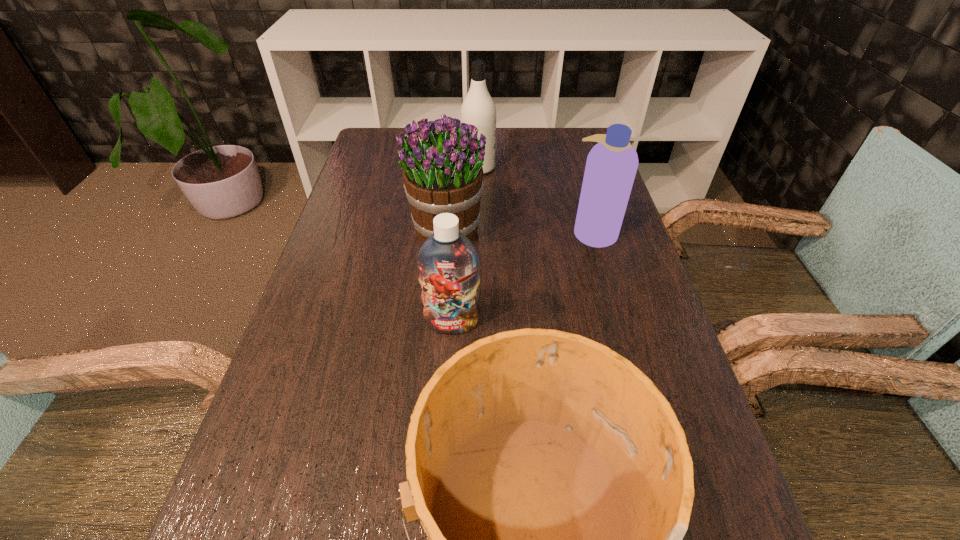
Locate an element on the screen. the farthest shampoo is located at coordinates (478, 108).

This screenshot has height=540, width=960. I want to click on bouquet, so (442, 164).

Find the location of a particular element. The height and width of the screenshot is (540, 960). the second nearest shampoo is located at coordinates (611, 166).

I want to click on the fourth farthest object, so click(448, 262).

Find the location of a particular element. free region located 0.230m on the front-facing side of the farthest object is located at coordinates (570, 168).

Find the location of a particular element. The height and width of the screenshot is (540, 960). vacant space situated on the right of the bouquet is located at coordinates (505, 229).

This screenshot has width=960, height=540. In order to click on free space located on the front of the rightmost shampoo in this screenshot , I will do `click(611, 292)`.

This screenshot has height=540, width=960. Find the location of `blank space located 0.310m on the front label of the nearest shampoo`. blank space located 0.310m on the front label of the nearest shampoo is located at coordinates (443, 496).

Locate an element on the screen. The image size is (960, 540). object located at the far edge is located at coordinates (478, 108).

The width and height of the screenshot is (960, 540). What are the coordinates of `object at the right edge` in the screenshot? It's located at point(611,166).